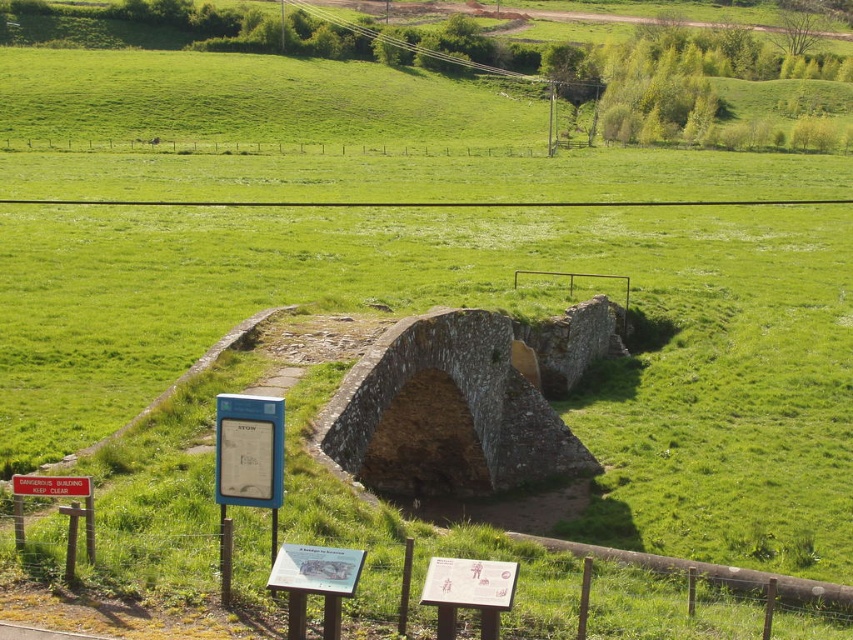
Question: Does stone arch bridge at center appear under red plastic sign at lower left?

Choices:
 (A) yes
 (B) no

Answer: (A)

Question: Among these objects, which one is farthest from the camera?

Choices:
 (A) stone arch bridge at center
 (B) red plastic sign at lower left

Answer: (A)

Question: Which of the following is the closest to the observer?

Choices:
 (A) (399, 372)
 (B) (15, 480)

Answer: (B)

Question: Where is stone arch bridge at center located in relation to red plastic sign at lower left in the image?

Choices:
 (A) below
 (B) above

Answer: (A)

Question: Does stone arch bridge at center appear on the right side of red plastic sign at lower left?

Choices:
 (A) yes
 (B) no

Answer: (A)

Question: Which of the following is the farthest from the observer?

Choices:
 (A) stone arch bridge at center
 (B) red plastic sign at lower left

Answer: (A)